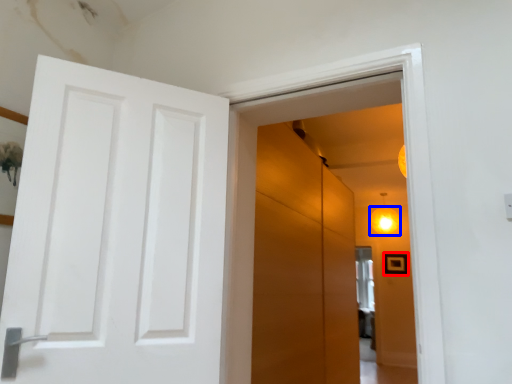
Question: Which of the following is the farthest to the observer, picture frame (highlighted by a red box) or lighting (highlighted by a blue box)?

Choices:
 (A) picture frame
 (B) lighting

Answer: (A)